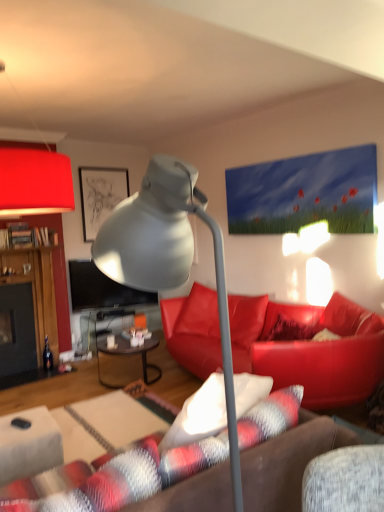
You are a GUI agent. You are given a task and a screenshot of the screen. Output one action in this format:
    pyautogui.click(x=<x>, y=<y>)
    Task: Click on the free spot in front of black rubberized corded phone at lower left
    The image size is (384, 512).
    Given the screenshot: What is the action you would take?
    pyautogui.click(x=17, y=433)